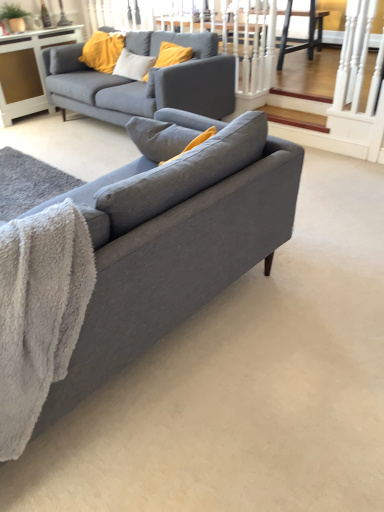
Question: Looking at the image, does matte gray couch at center, arranged as the first studio couch when ordered from the bottom, seem bigger or smaller compared to gray fluffy blanket at lower left?

Choices:
 (A) small
 (B) big

Answer: (B)

Question: Do you think matte gray couch at center, arranged as the first studio couch when ordered from the bottom, is within gray fluffy blanket at lower left, or outside of it?

Choices:
 (A) inside
 (B) outside

Answer: (B)

Question: Estimate the real-world distances between objects in this image. Which object is closer to the matte gray couch at center, which is counted as the 2th studio couch, starting from the front?

Choices:
 (A) white glossy cabinet at upper left
 (B) matte gray couch at center, which is the second studio couch in top-to-bottom order
 (C) gray fluffy blanket at lower left

Answer: (A)

Question: Estimate the real-world distances between objects in this image. Which object is closer to the white glossy cabinet at upper left?

Choices:
 (A) gray fluffy blanket at lower left
 (B) matte gray couch at center, which is counted as the 2th studio couch, starting from the front
 (C) matte gray couch at center, which is the second studio couch in top-to-bottom order

Answer: (B)